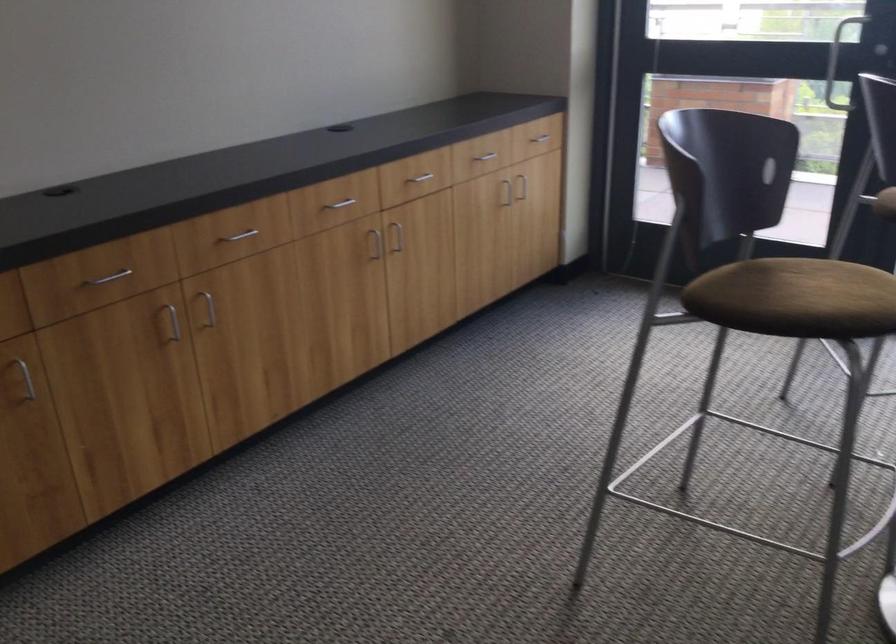
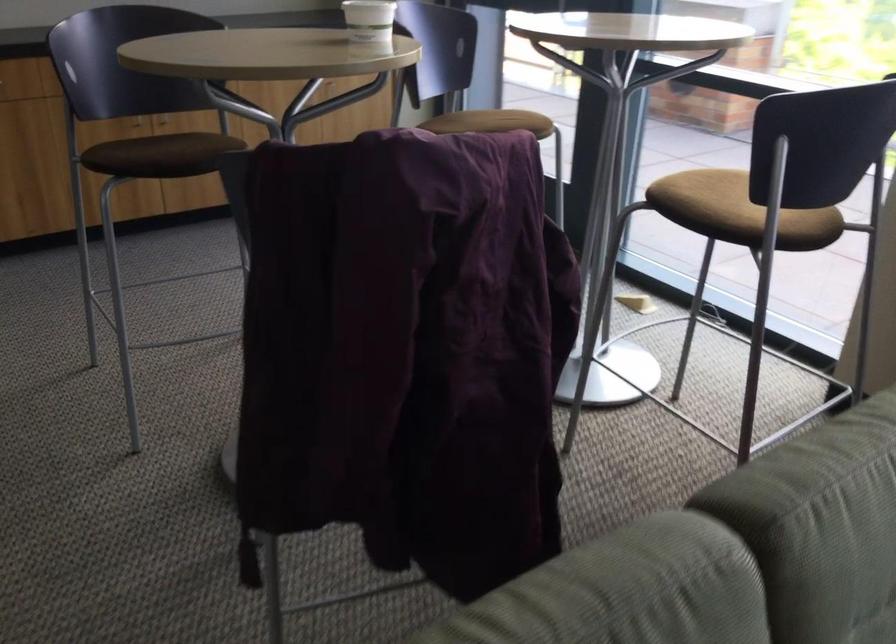
Question: What movement of the cameraman would produce the second image?

Choices:
 (A) Left
 (B) Right
 (C) Forward
 (D) Backward

Answer: (B)